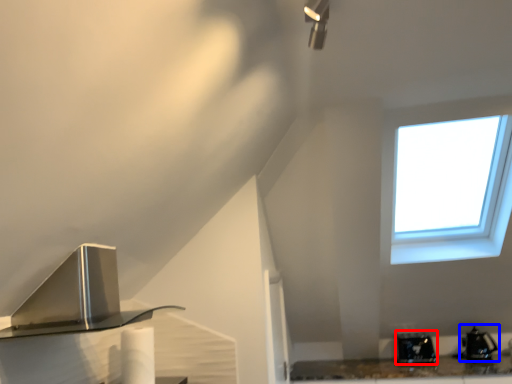
Question: Which of the following is the farthest to the observer, appliance (highlighted by a red box) or appliance (highlighted by a blue box)?

Choices:
 (A) appliance
 (B) appliance

Answer: (A)